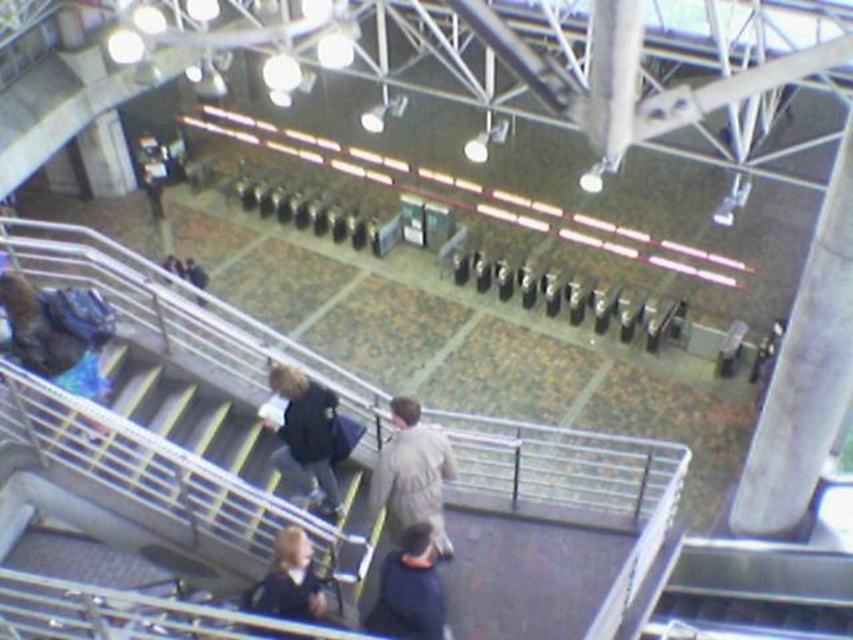
Question: Based on their relative distances, which object is nearer to the light brown fabric jacket at center?

Choices:
 (A) dark blue jacket at center
 (B) dark blue jacket at lower center
 (C) dark blue fabric at lower center

Answer: (C)

Question: Which object is closer to the camera taking this photo?

Choices:
 (A) light brown fabric jacket at center
 (B) dark blue jacket at lower center

Answer: (B)

Question: Which point is farther to the camera?

Choices:
 (A) (439, 582)
 (B) (293, 403)
 (C) (292, 612)
 (D) (416, 500)

Answer: (B)

Question: Does dark blue jacket at center have a lesser width compared to dark blue fabric at lower center?

Choices:
 (A) no
 (B) yes

Answer: (A)

Question: Where is light brown fabric jacket at center located in relation to dark blue jacket at center in the image?

Choices:
 (A) right
 (B) left

Answer: (A)

Question: Can you confirm if dark blue jacket at center is wider than dark blue fabric at lower center?

Choices:
 (A) no
 (B) yes

Answer: (B)